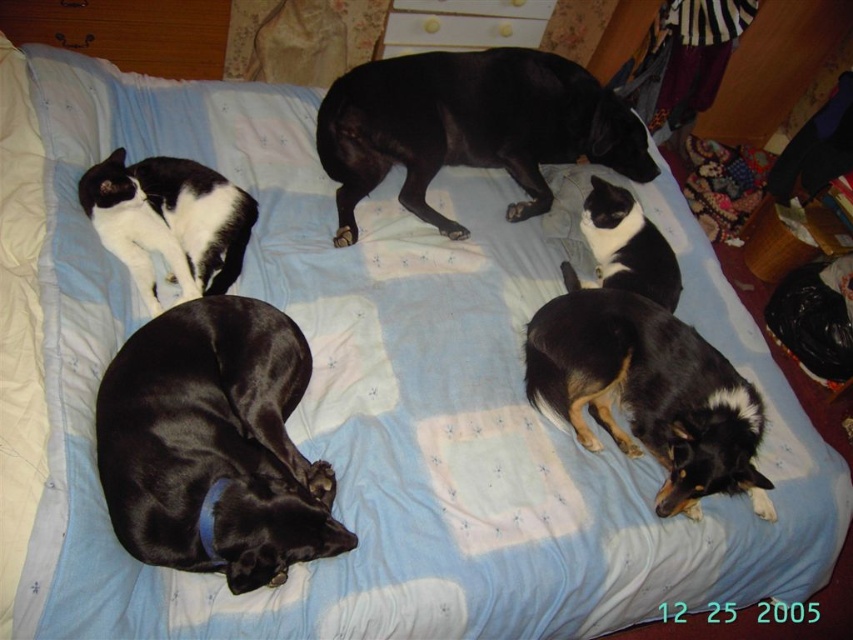
You are a photographer trying to capture a clear photo of the black smooth dog at upper center without the black and white fur cat at center appearing in the foreground. Is this possible given their positions?

The black smooth dog at upper center is positioned over the black and white fur cat at center, so the cat would appear in the foreground, making it impossible to capture a clear photo of the dog without the cat in the foreground.

From the picture: You are a photographer trying to capture a closeup of the shiny black dog at lower left without including the black and tan fur dog at center in the shot. Given their sizes in the image, is this possible?

The shiny black dog at lower left occupies less space than black and tan fur dog at center, so it might be challenging to capture a closeup of the shiny black dog at lower left without including the black and tan fur dog at center in the shot due to their size difference.

You are standing at the bottom left corner of the bed and want to reach the point marked at point (692, 364). Is the point marked at point (305, 484) blocking your path?

Point (305, 484) is in front of point (692, 364), so yes, the point marked at point (305, 484) is blocking your path to point (692, 364).